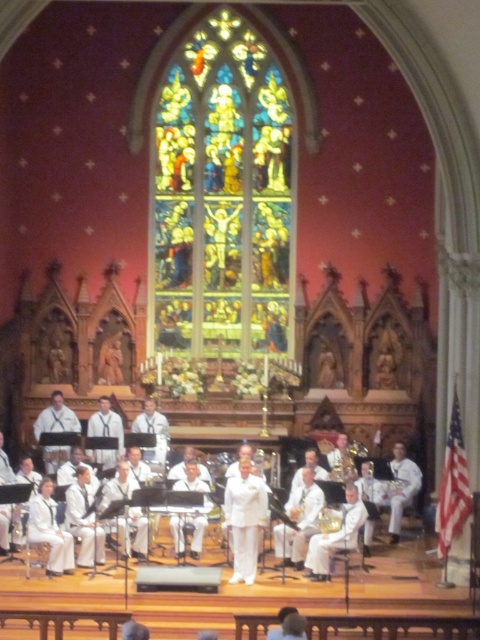
Question: Can you confirm if stained glass window at center is positioned to the left of gold metallic saxophone at center?

Choices:
 (A) yes
 (B) no

Answer: (A)

Question: Is white uniform at center positioned in front of gold metallic saxophone at center?

Choices:
 (A) yes
 (B) no

Answer: (B)

Question: Which point is closer to the camera?

Choices:
 (A) gold metallic saxophone at center
 (B) white uniform at center

Answer: (A)

Question: Which of the following is the closest to the observer?

Choices:
 (A) (204, 61)
 (B) (325, 516)

Answer: (B)

Question: Which point is farther to the camera?

Choices:
 (A) (171, 468)
 (B) (223, 186)
 (C) (337, 516)

Answer: (B)

Question: Does white uniform at center have a lesser width compared to gold metallic saxophone at center?

Choices:
 (A) yes
 (B) no

Answer: (B)